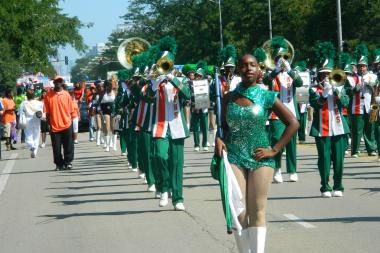
This screenshot has width=380, height=253. Identify the location of stockings. (257, 177), (238, 175).